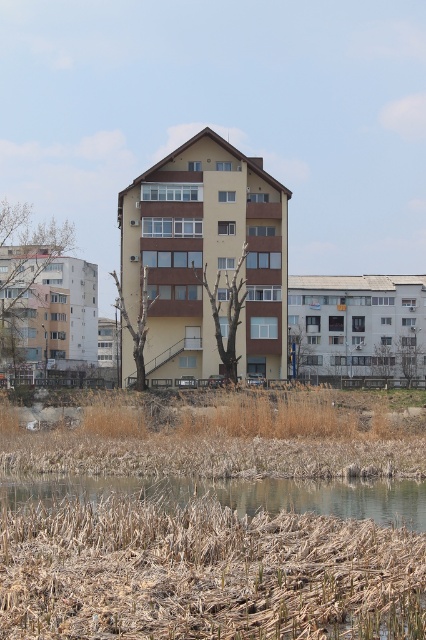
You are standing in front of the residential building and want to walk to the brown grassy river at lower center. Which direction should you move relative to the brown dry reed at lower left?

You should move to the right relative to the brown dry reed at lower left because the brown grassy river at lower center is positioned to the right of the brown dry reed at lower left.

You are standing in the urban landscape and want to cross from the brown dry reed at lower left to the brown grassy river at lower center. Can you walk directly between them?

The brown dry reed at lower left is above brown grassy river at lower center, so you can walk directly between them as the reed is elevated and the river is below.

You are standing in front of the residential building and want to determine the relative positions of two points marked in the image. Which of the two points, point (412, 582) or point (250, 496), is closer to you?

Point (412, 582) is closer to the viewer than point (250, 496).